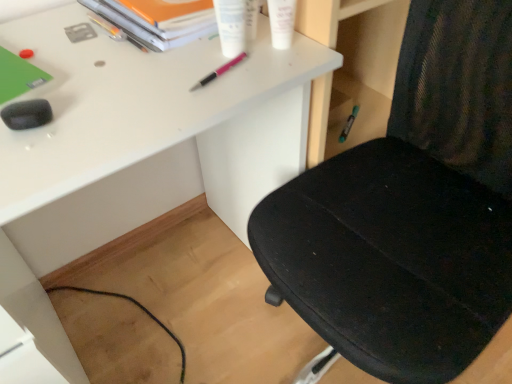
Where is `vacant area that lies in front of pink metallic pen at upper center, the third stationery positioned from the left`? vacant area that lies in front of pink metallic pen at upper center, the third stationery positioned from the left is located at coordinates (181, 113).